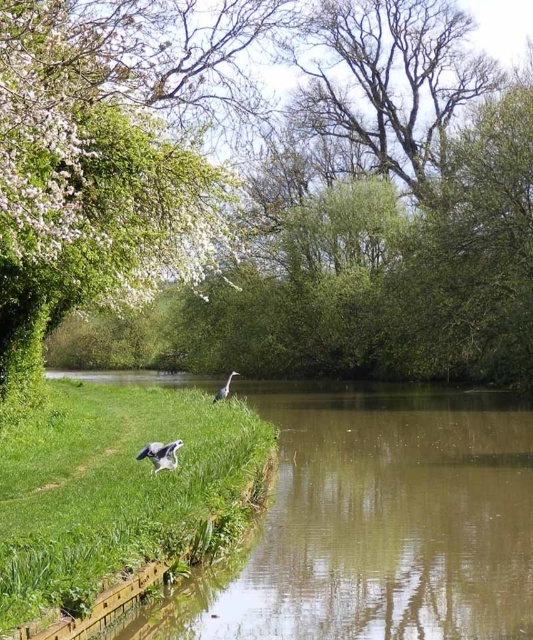
Question: Among these points, which one is nearest to the camera?

Choices:
 (A) (217, 394)
 (B) (221, 465)

Answer: (B)

Question: Does green grass at lower left have a lesser width compared to gray feathered bird at lower left?

Choices:
 (A) no
 (B) yes

Answer: (A)

Question: Does green leafy tree at upper left appear under white feathered bird at center?

Choices:
 (A) yes
 (B) no

Answer: (B)

Question: Which point appears farthest from the camera in this image?

Choices:
 (A) (64, 205)
 (B) (225, 388)

Answer: (B)

Question: Among these points, which one is farthest from the camera?

Choices:
 (A) (374, 16)
 (B) (82, 444)
 (C) (163, 468)

Answer: (A)

Question: Is green leafy tree at upper left above green grass at lower left?

Choices:
 (A) no
 (B) yes

Answer: (B)